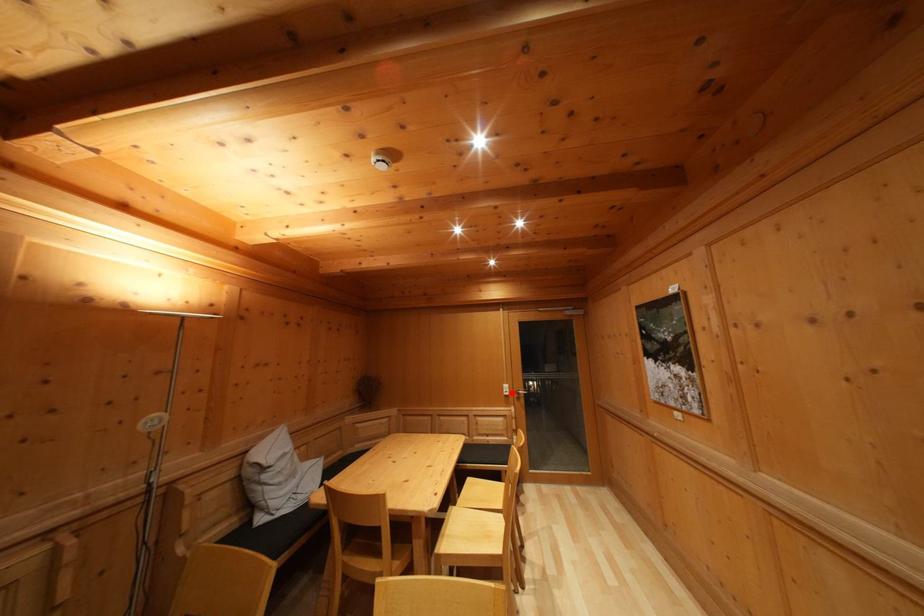
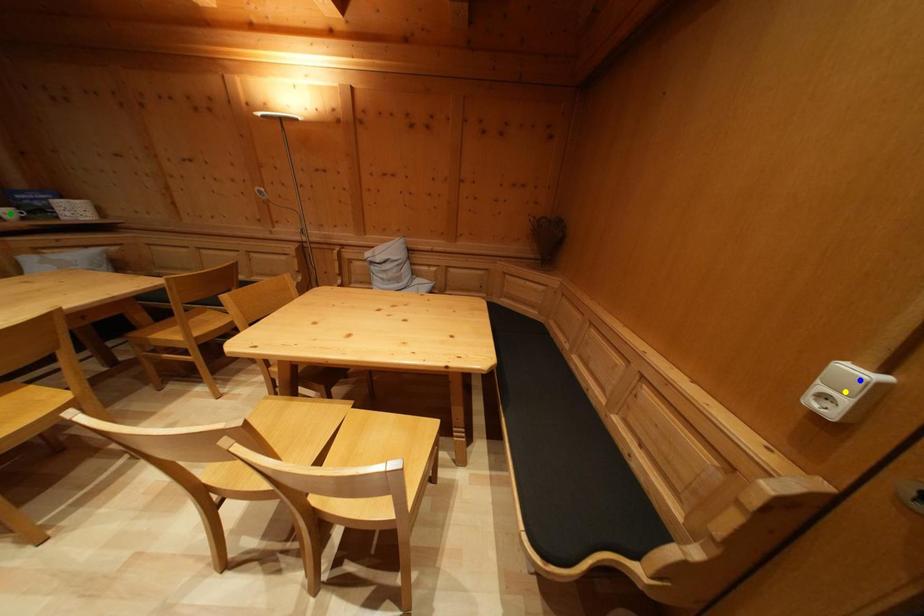
Question: I am providing you with two images of the same scene from different viewpoints. A red point is marked on the first image. You are given multiple points on the second image. Can you choose the point in image 2 that corresponds to the point in image 1?

Choices:
 (A) blue point
 (B) yellow point
 (C) green point

Answer: (A)